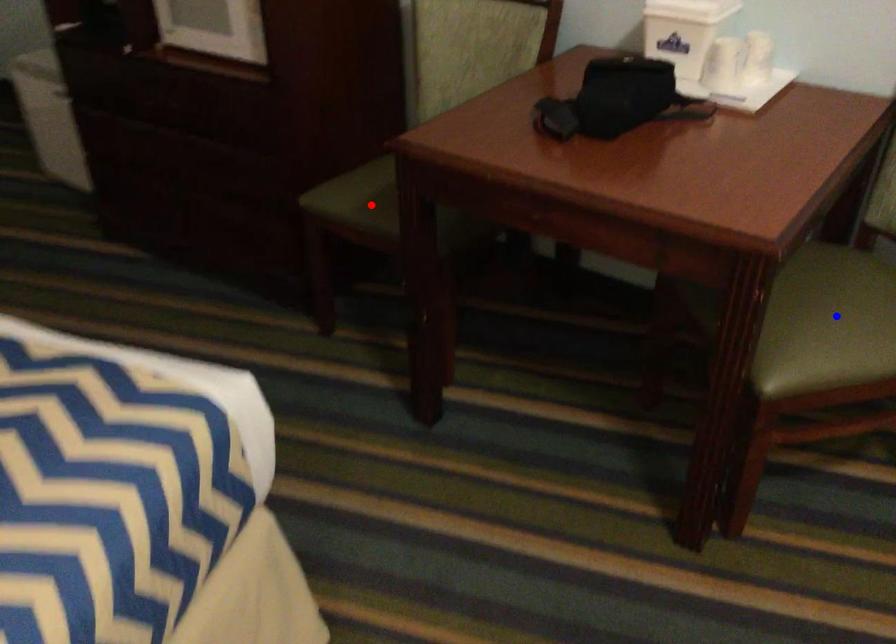
Question: Which of the two points in the image is closer to the camera?

Choices:
 (A) Blue point is closer.
 (B) Red point is closer.

Answer: (A)